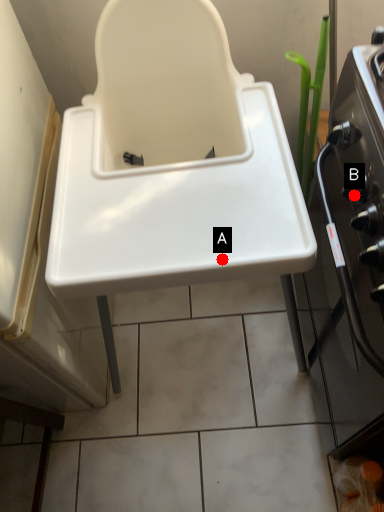
Question: Two points are circled on the image, labeled by A and B beside each circle. Which point is farther to the camera?

Choices:
 (A) A is further
 (B) B is further

Answer: (B)